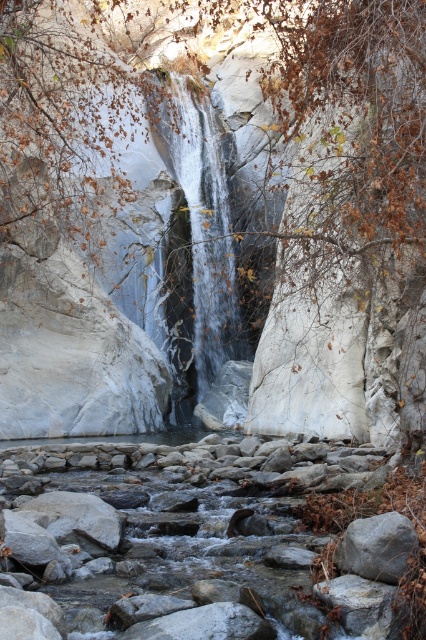
Looking at this image, who is more forward, (196, 115) or (408, 532)?

Point (408, 532) is in front.

In order to click on smooth gray rock at center in this screenshot , I will do `click(198, 225)`.

Is point (160, 124) closer to viewer compared to point (403, 552)?

No, it is behind (403, 552).

You are a GUI agent. You are given a task and a screenshot of the screen. Output one action in this format:
    pyautogui.click(x=<x>, y=<y>)
    Task: Click on the smooth gray rock at center
    This screenshot has height=640, width=426.
    Given the screenshot: What is the action you would take?
    pyautogui.click(x=198, y=225)